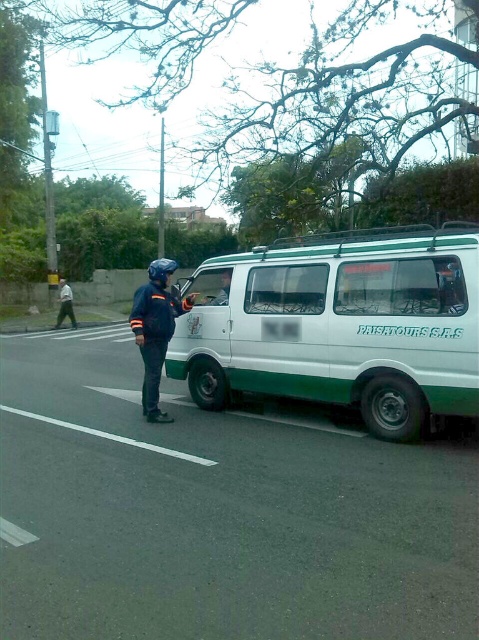
Question: Can you confirm if dark blue jacket at center is bigger than dark blue uniform at left?

Choices:
 (A) no
 (B) yes

Answer: (B)

Question: Which of the following is the closest to the observer?

Choices:
 (A) (68, 300)
 (B) (401, 364)
 (C) (216, 301)

Answer: (B)

Question: Among these objects, which one is nearest to the camera?

Choices:
 (A) dark blue uniform at left
 (B) dark blue jacket at center
 (C) white matte van at center
 (D) matte black helmet at upper center

Answer: (C)

Question: Is white matte van at center behind dark blue jacket at center?

Choices:
 (A) no
 (B) yes

Answer: (A)

Question: Which of the following is the farthest from the observer?

Choices:
 (A) (159, 369)
 (B) (410, 392)
 (C) (218, 296)
 (D) (68, 305)

Answer: (D)

Question: Can you confirm if white matte van at center is positioned to the left of dark blue uniform at left?

Choices:
 (A) yes
 (B) no

Answer: (B)